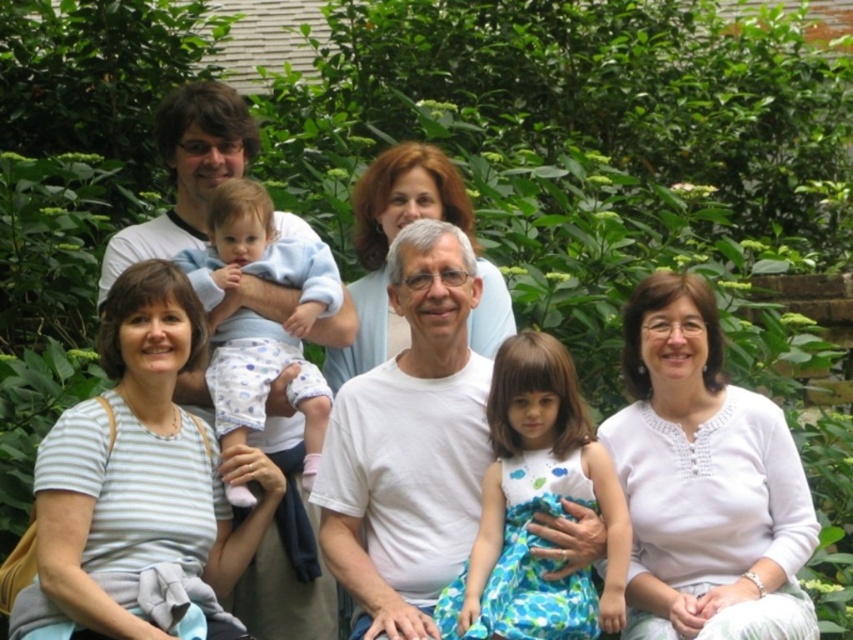
Question: Considering the real-world distances, which object is farthest from the smooth white blouse at center?

Choices:
 (A) light blue cotton onesie at center
 (B) printed cotton dress at center

Answer: (B)

Question: Observing the image, what is the correct spatial positioning of white cotton shirt at center in reference to printed cotton dress at center?

Choices:
 (A) below
 (B) above

Answer: (B)

Question: Based on their relative distances, which object is nearer to the smooth white blouse at center?

Choices:
 (A) white textured blouse at center
 (B) light blue cotton onesie at center
 (C) printed cotton dress at center

Answer: (B)

Question: Does white textured blouse at center have a greater width compared to printed cotton dress at center?

Choices:
 (A) yes
 (B) no

Answer: (A)

Question: Based on their relative distances, which object is nearer to the white striped shirt at lower left?

Choices:
 (A) light blue cotton onesie at center
 (B) white cotton shirt at center

Answer: (A)

Question: Is printed cotton dress at center above light blue cotton onesie at center?

Choices:
 (A) no
 (B) yes

Answer: (A)